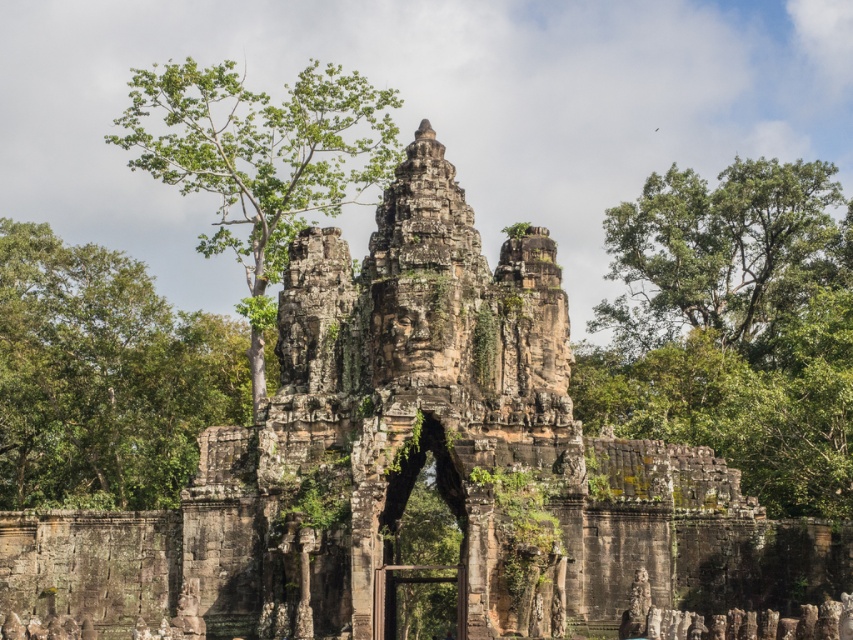
Who is more distant from viewer, (659, 333) or (256, 188)?

Positioned behind is point (659, 333).

Is point (648, 374) positioned before point (242, 202)?

Yes, it is.

Between point (753, 410) and point (360, 81), which one is positioned in front?

Point (753, 410) is more forward.

Image resolution: width=853 pixels, height=640 pixels. Identify the location of green leafy tree at right. (733, 328).

Can you confirm if green leafy tree at left is shorter than green leafy tree at upper left?

Correct, green leafy tree at left is not as tall as green leafy tree at upper left.

Who is more forward, (33, 259) or (160, 140)?

Point (33, 259) is more forward.

Does point (93, 291) come farther from viewer compared to point (329, 131)?

Yes, point (93, 291) is farther from viewer.

Identify the location of green leafy tree at left. The width and height of the screenshot is (853, 640). (103, 378).

Can you confirm if green leafy tree at right is bigger than green leafy tree at left?

Indeed, green leafy tree at right has a larger size compared to green leafy tree at left.

From the picture: Is green leafy tree at right to the left of green leafy tree at left from the viewer's perspective?

In fact, green leafy tree at right is to the right of green leafy tree at left.

The image size is (853, 640). Find the location of `green leafy tree at right`. green leafy tree at right is located at coordinates (733, 328).